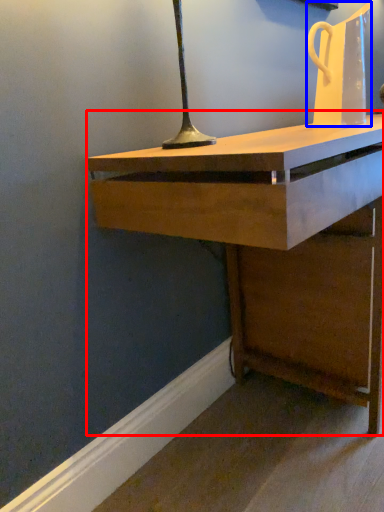
Question: Among these objects, which one is farthest to the camera, desk (highlighted by a red box) or jug (highlighted by a blue box)?

Choices:
 (A) desk
 (B) jug

Answer: (B)